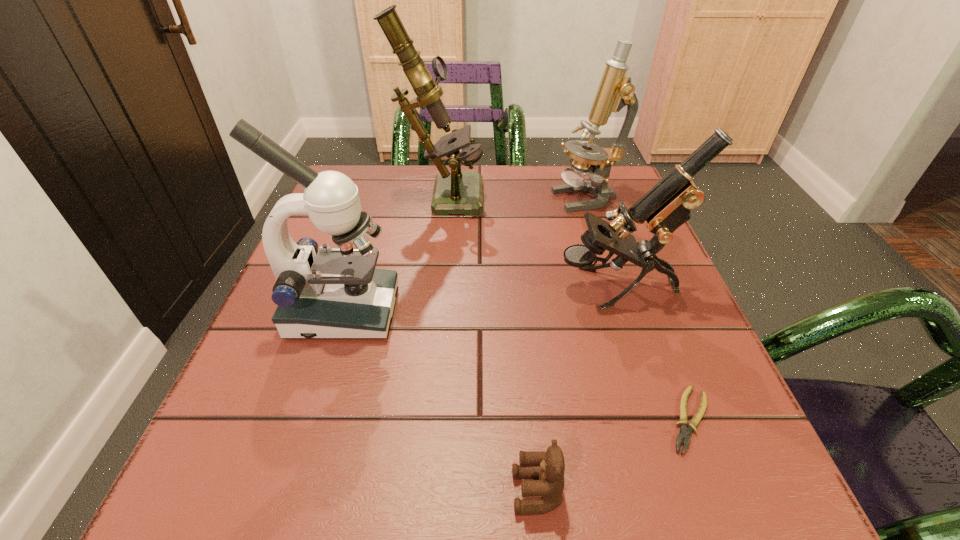
Image resolution: width=960 pixels, height=540 pixels. I want to click on free point at the near right corner, so click(712, 476).

I want to click on object that can be found as the second closest to the third object from left to right, so tap(335, 293).

Locate an element on the screen. object identified as the second closest to the pliers is located at coordinates click(549, 467).

You are a GUI agent. You are given a task and a screenshot of the screen. Output one action in this format:
    pyautogui.click(x=<x>, y=<y>)
    Task: Click on the third closest microscope to the third object from left to right
    
    Given the screenshot: What is the action you would take?
    pyautogui.click(x=455, y=192)

Point out which microscope is positioned as the fourth nearest to the second shortest object. Please provide its 2D coordinates. Your answer should be formatted as a tuple, i.e. [(x, y)], where the tuple contains the x and y coordinates of a point satisfying the conditions above.

[(615, 91)]